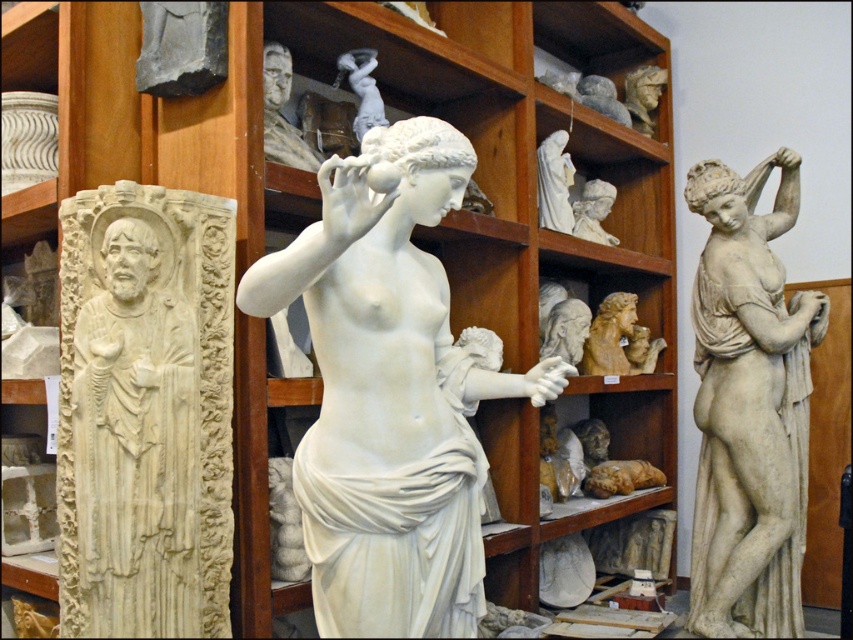
Is white marble relief at left taller than light brown wood carving at center?

Yes, white marble relief at left is taller than light brown wood carving at center.

You are a GUI agent. You are given a task and a screenshot of the screen. Output one action in this format:
    pyautogui.click(x=<x>, y=<y>)
    Task: Click on the white marble relief at left
    
    Given the screenshot: What is the action you would take?
    pyautogui.click(x=144, y=412)

Which is behind, point (695, 202) or point (610, 344)?

Point (610, 344)

Can you confirm if white marble statue at right is positioned below light brown wood carving at center?

Correct, white marble statue at right is located below light brown wood carving at center.

Which is behind, point (775, 362) or point (618, 348)?

The point (618, 348) is more distant.

The image size is (853, 640). In order to click on white marble statue at right in this screenshot , I will do `click(749, 406)`.

Who is positioned more to the right, white marble statue at center or white marble statue at right?

From the viewer's perspective, white marble statue at right appears more on the right side.

Who is taller, white marble statue at center or white marble statue at right?

Standing taller between the two is white marble statue at right.

This screenshot has width=853, height=640. I want to click on white marble statue at center, so click(389, 394).

This screenshot has width=853, height=640. In order to click on white marble statue at center in this screenshot , I will do `click(389, 394)`.